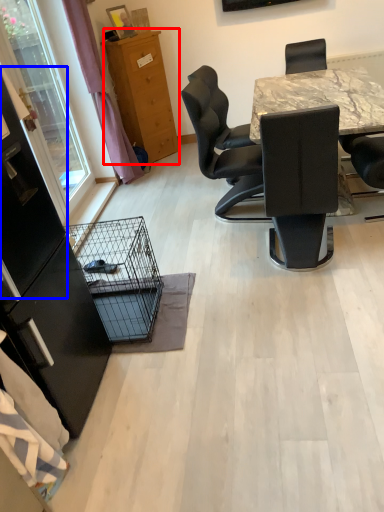
Question: Among these objects, which one is nearest to the camera, cabinetry (highlighted by a red box) or screen door (highlighted by a blue box)?

Choices:
 (A) cabinetry
 (B) screen door

Answer: (B)